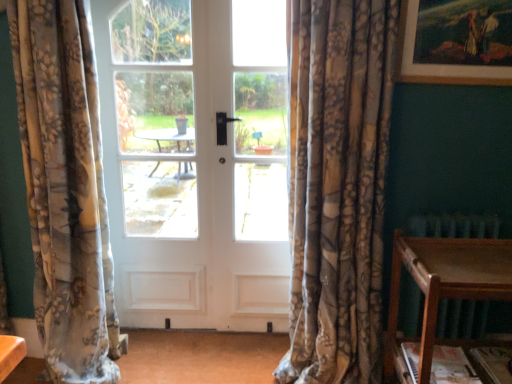
At what (x,y) coordinates should I click in order to perform the action: click on wooden picture frame at upper right. Please return your answer as a coordinate pair (x, y). Looking at the image, I should click on (439, 65).

What do you see at coordinates (196, 160) in the screenshot?
I see `white matte door at center` at bounding box center [196, 160].

At what (x,y) coordinates should I click in order to perform the action: click on floral fabric curtain at center, the second curtain from the left. Please return your answer as a coordinate pair (x, y). The width and height of the screenshot is (512, 384). Looking at the image, I should click on (338, 186).

Measure the distance between point (x=38, y=141) and camera.

A distance of 1.73 meters exists between point (x=38, y=141) and camera.

The height and width of the screenshot is (384, 512). Describe the element at coordinates (65, 190) in the screenshot. I see `floral fabric curtain at left, the second curtain from the right` at that location.

Identify the location of wooden picture frame at upper right. (439, 65).

Measure the distance from wooden picture frame at upper right to white matte door at center.

wooden picture frame at upper right and white matte door at center are 1.07 meters apart from each other.

Considering the sizes of objects wooden picture frame at upper right and white matte door at center in the image provided, who is taller, wooden picture frame at upper right or white matte door at center?

white matte door at center.

How different are the orientations of wooden picture frame at upper right and white matte door at center in degrees?

wooden picture frame at upper right and white matte door at center are facing 0.743 degrees away from each other.

Is point (402, 57) positioned behind point (209, 31)?

No, it is not.

Find the location of a particular element. the 2nd curtain directly beneath the wooden picture frame at upper right (from a real-world perspective) is located at coordinates (65, 190).

Is floral fabric curtain at left, the second curtain from the right, oriented towards wooden picture frame at upper right?

No.

Which object is closer to the camera taking this photo, floral fabric curtain at left, the second curtain from the right, or wooden picture frame at upper right?

Positioned in front is floral fabric curtain at left, the second curtain from the right.

Do you think floral fabric curtain at left, the second curtain from the right, is within wooden picture frame at upper right, or outside of it?

floral fabric curtain at left, the second curtain from the right, exists outside the volume of wooden picture frame at upper right.

From a real-world perspective, is wooden table at lower right positioned under white matte door at center based on gravity?

Yes, from a real-world perspective, wooden table at lower right is below white matte door at center.

Considering the sizes of wooden table at lower right and white matte door at center in the image, is wooden table at lower right bigger or smaller than white matte door at center?

wooden table at lower right is bigger than white matte door at center.

This screenshot has height=384, width=512. I want to click on table located in front of the white matte door at center, so click(444, 286).

Visually, is wooden table at lower right positioned to the left or to the right of white matte door at center?

wooden table at lower right is positioned on white matte door at center's right side.

Considering the points (500, 85) and (497, 252), which point is behind, point (500, 85) or point (497, 252)?

The point (500, 85) is farther from the camera.

Is wooden picture frame at upper right with wooden table at lower right?

No, wooden picture frame at upper right is not beside wooden table at lower right.

Could you tell me if wooden picture frame at upper right is turned towards wooden table at lower right?

No, wooden picture frame at upper right is not oriented towards wooden table at lower right.

From the image's perspective, which one is positioned lower, wooden picture frame at upper right or wooden table at lower right?

wooden table at lower right, from the image's perspective.

Is floral fabric curtain at left, the second curtain from the right, closer to the viewer compared to white matte door at center?

Yes, it is in front of white matte door at center.

Does floral fabric curtain at left, the second curtain from the right, have a greater height compared to white matte door at center?

In fact, floral fabric curtain at left, the second curtain from the right, may be shorter than white matte door at center.

Image resolution: width=512 pixels, height=384 pixels. In order to click on door above the floral fabric curtain at left, the second curtain from the right (from the image's perspective) in this screenshot , I will do `click(196, 160)`.

Does floral fabric curtain at left, the 1th curtain viewed from the left, have a larger size compared to white matte door at center?

Yes, floral fabric curtain at left, the 1th curtain viewed from the left, is bigger than white matte door at center.

This screenshot has width=512, height=384. Find the location of `the 1st curtain in front of the white matte door at center, starting your count from the anchor`. the 1st curtain in front of the white matte door at center, starting your count from the anchor is located at coordinates (65, 190).

From the image's perspective, between white matte door at center and floral fabric curtain at left, the second curtain from the right, who is located below?

floral fabric curtain at left, the second curtain from the right, from the image's perspective.

Which is behind, point (282, 271) or point (26, 66)?

The point (282, 271) is behind.

Do you think white matte door at center is within floral fabric curtain at left, the 1th curtain viewed from the left, or outside of it?

white matte door at center is spatially situated outside floral fabric curtain at left, the 1th curtain viewed from the left.

Which of these two, wooden picture frame at upper right or floral fabric curtain at center, arranged as the 1th curtain when viewed from the right, is smaller?

wooden picture frame at upper right.

Could you tell me if wooden picture frame at upper right is turned towards floral fabric curtain at center, the second curtain from the left?

No.

You are a GUI agent. You are given a task and a screenshot of the screen. Output one action in this format:
    pyautogui.click(x=<x>, y=<y>)
    Task: Click on the picture frame that is behind the floral fabric curtain at center, arranged as the 1th curtain when viewed from the right
    The image size is (512, 384).
    Given the screenshot: What is the action you would take?
    pyautogui.click(x=439, y=65)

Which object is further away from the camera taking this photo, wooden picture frame at upper right or floral fabric curtain at center, arranged as the 1th curtain when viewed from the right?

wooden picture frame at upper right is more distant.

Identify the location of door directly beneath the wooden picture frame at upper right (from a real-world perspective). Image resolution: width=512 pixels, height=384 pixels. (196, 160).

Where is `curtain that is the 2nd one when counting downward from the wooden picture frame at upper right (from the image's perspective)`? This screenshot has height=384, width=512. curtain that is the 2nd one when counting downward from the wooden picture frame at upper right (from the image's perspective) is located at coordinates (65, 190).

Looking at this image, from the image, which object appears to be farther from floral fabric curtain at left, the 1th curtain viewed from the left, white matte door at center or floral fabric curtain at center, the second curtain from the left?

floral fabric curtain at center, the second curtain from the left, is further to floral fabric curtain at left, the 1th curtain viewed from the left.

From the image, which object appears to be nearer to wooden picture frame at upper right, floral fabric curtain at center, the second curtain from the left, or floral fabric curtain at left, the second curtain from the right?

floral fabric curtain at center, the second curtain from the left, lies closer to wooden picture frame at upper right than the other object.

Considering their positions, is white matte door at center positioned closer to floral fabric curtain at left, the second curtain from the right, than wooden picture frame at upper right?

white matte door at center is positioned closer to the anchor floral fabric curtain at left, the second curtain from the right.

Which object lies nearer to the anchor point floral fabric curtain at left, the 1th curtain viewed from the left, wooden table at lower right or floral fabric curtain at center, the second curtain from the left?

floral fabric curtain at center, the second curtain from the left.

When comparing their distances from wooden picture frame at upper right, does floral fabric curtain at center, the second curtain from the left, or wooden table at lower right seem further?

Based on the image, wooden table at lower right appears to be further to wooden picture frame at upper right.

Which object lies nearer to the anchor point white matte door at center, wooden table at lower right or wooden picture frame at upper right?

wooden table at lower right is positioned closer to the anchor white matte door at center.

Based on their spatial positions, is floral fabric curtain at left, the 1th curtain viewed from the left, or wooden table at lower right closer to floral fabric curtain at center, the second curtain from the left?

wooden table at lower right is closer to floral fabric curtain at center, the second curtain from the left.

When comparing their distances from wooden table at lower right, does white matte door at center or floral fabric curtain at left, the 1th curtain viewed from the left, seem further?

floral fabric curtain at left, the 1th curtain viewed from the left, is further to wooden table at lower right.

I want to click on table between white matte door at center and wooden picture frame at upper right in the horizontal direction, so click(x=444, y=286).

Identify the location of door between floral fabric curtain at left, the second curtain from the right, and wooden picture frame at upper right from left to right. (196, 160).

Image resolution: width=512 pixels, height=384 pixels. Identify the location of curtain situated between floral fabric curtain at left, the second curtain from the right, and wooden picture frame at upper right from left to right. (338, 186).

Locate an element on the screen. This screenshot has height=384, width=512. door between floral fabric curtain at left, the second curtain from the right, and floral fabric curtain at center, the second curtain from the left, from left to right is located at coordinates (196, 160).